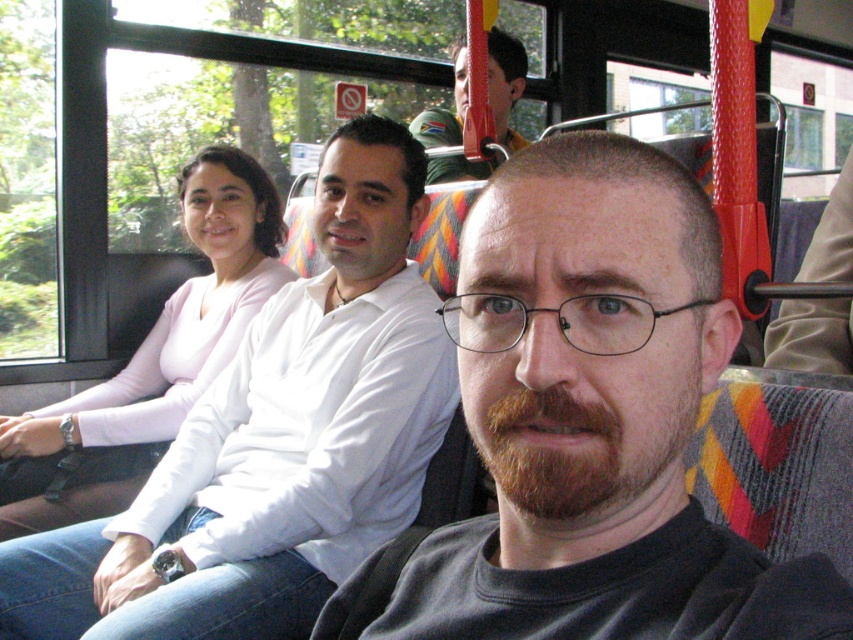
Question: Does pink matte sweater at upper left have a smaller size compared to green fabric cap at upper center?

Choices:
 (A) no
 (B) yes

Answer: (A)

Question: Can you confirm if dark gray shirt at center is bigger than green fabric cap at upper center?

Choices:
 (A) yes
 (B) no

Answer: (B)

Question: Which object is farther from the camera taking this photo?

Choices:
 (A) dark gray shirt at center
 (B) green fabric cap at upper center

Answer: (B)

Question: Can you confirm if dark gray shirt at center is thinner than pink matte sweater at upper left?

Choices:
 (A) no
 (B) yes

Answer: (B)

Question: Which point is closer to the camera taking this photo?

Choices:
 (A) (381, 572)
 (B) (445, 179)

Answer: (A)

Question: Estimate the real-world distances between objects in this image. Which object is closer to the dark gray shirt at center?

Choices:
 (A) pink matte sweater at upper left
 (B) green fabric cap at upper center

Answer: (A)